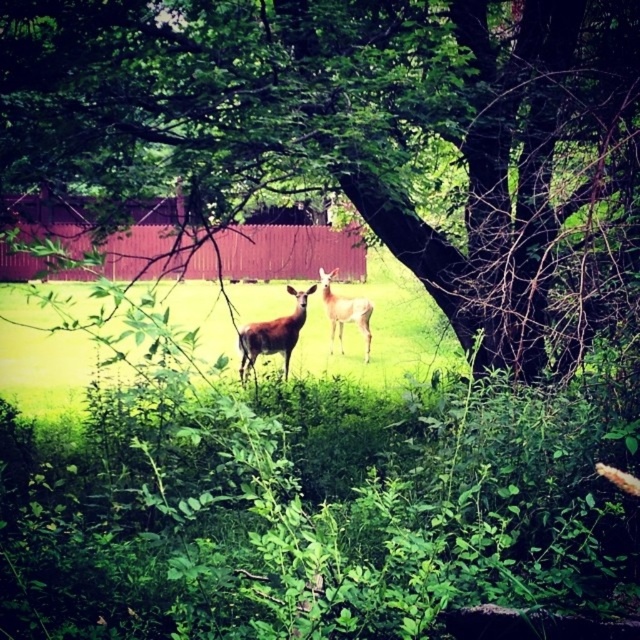
In the scene shown: Can you confirm if brown velvet deer at center is bigger than light brown fur at center?

No, brown velvet deer at center is not bigger than light brown fur at center.

Is point (248, 355) less distant than point (356, 323)?

Yes, point (248, 355) is in front of point (356, 323).

Locate an element on the screen. brown velvet deer at center is located at coordinates pyautogui.click(x=273, y=333).

Between green leafy tree at center and brown velvet deer at center, which one appears on the right side from the viewer's perspective?

From the viewer's perspective, green leafy tree at center appears more on the right side.

Does green leafy tree at center appear over brown velvet deer at center?

Yes.

Where is `green leafy tree at center`? green leafy tree at center is located at coordinates pyautogui.click(x=355, y=140).

Between point (444, 269) and point (368, 352), which one is positioned in front?

Point (444, 269) is more forward.

How much distance is there between green leafy tree at center and light brown fur at center?

The distance of green leafy tree at center from light brown fur at center is 28.00 feet.

This screenshot has width=640, height=640. I want to click on green leafy tree at center, so click(355, 140).